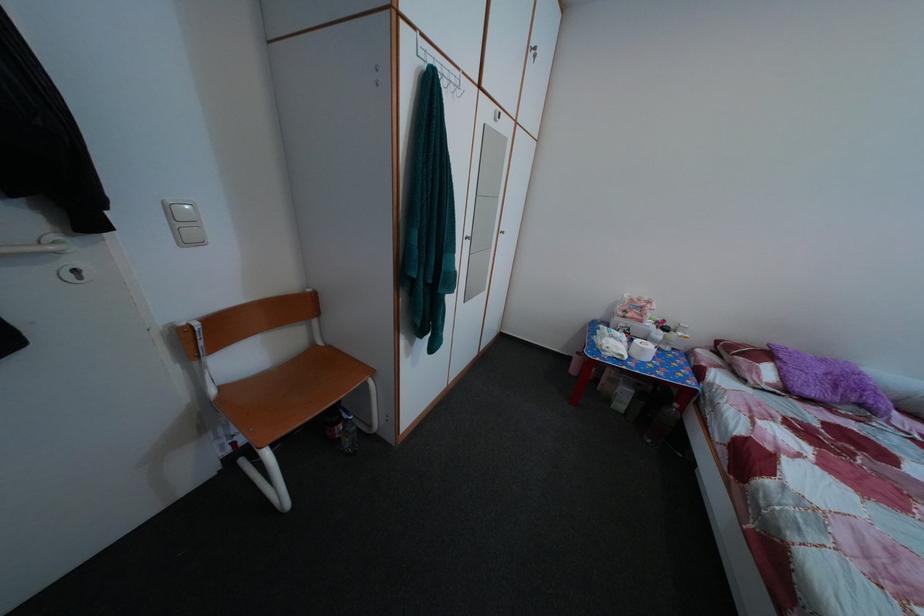
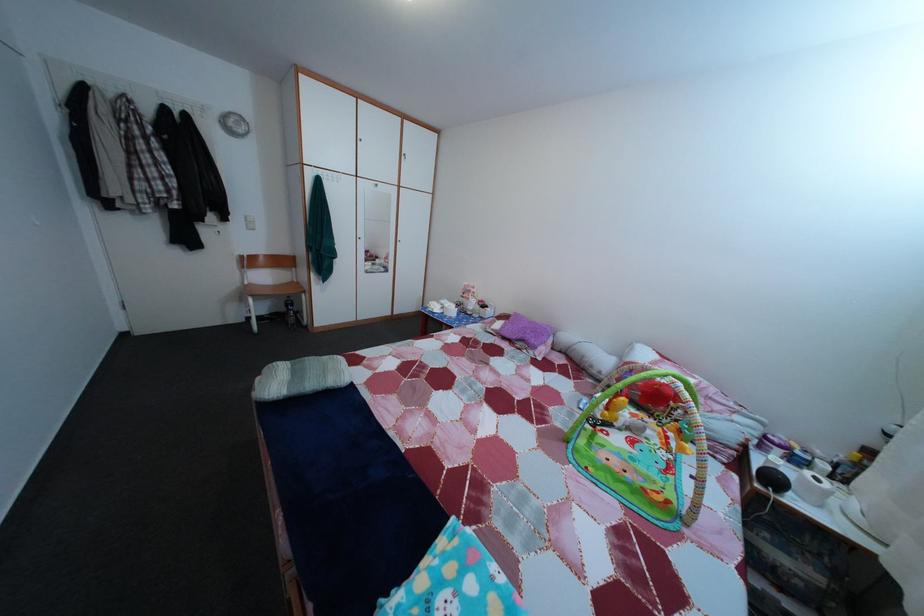
In a continuous first-person perspective shot, in which direction is the camera moving?

The cameraman walked toward right, backward.